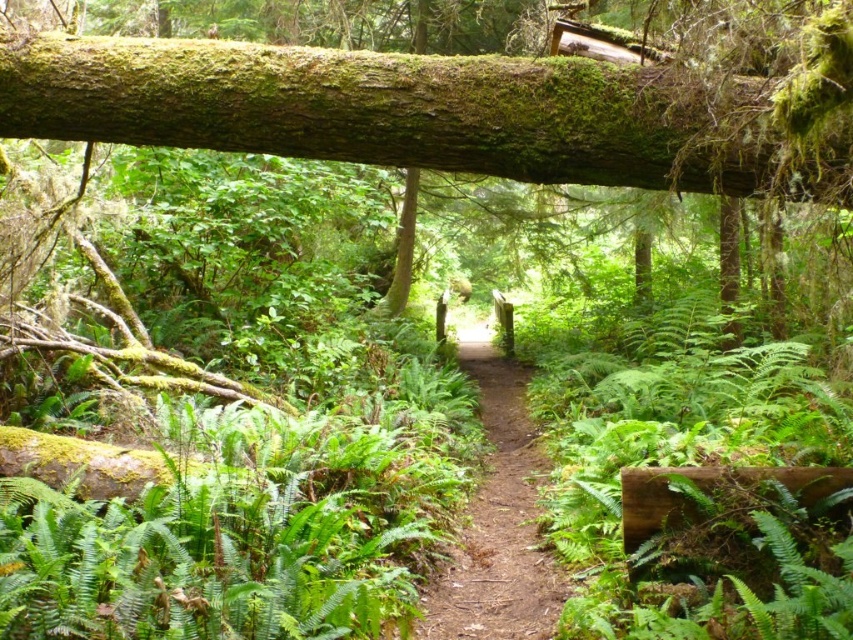
Is dirt path at center behind green mossy log at center?

No.

I want to click on dirt path at center, so click(x=497, y=520).

This screenshot has height=640, width=853. What are the coordinates of `dirt path at center` in the screenshot? It's located at (497, 520).

Looking at this image, does green mossy log at upper center appear over dirt path at center?

Correct, green mossy log at upper center is located above dirt path at center.

You are a GUI agent. You are given a task and a screenshot of the screen. Output one action in this format:
    pyautogui.click(x=<x>, y=<y>)
    Task: Click on the green mossy log at upper center
    This screenshot has width=853, height=640.
    Given the screenshot: What is the action you would take?
    pyautogui.click(x=419, y=113)

Does point (482, 118) lie behind point (485, 612)?

No.

Locate an element on the screen. green mossy log at upper center is located at coordinates (419, 113).

Which is in front, point (653, 140) or point (392, 292)?

Point (653, 140)

This screenshot has width=853, height=640. I want to click on green mossy log at upper center, so click(419, 113).